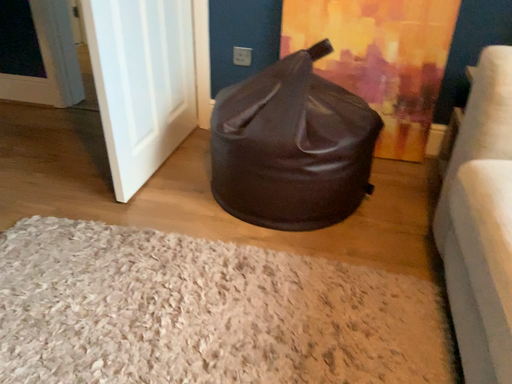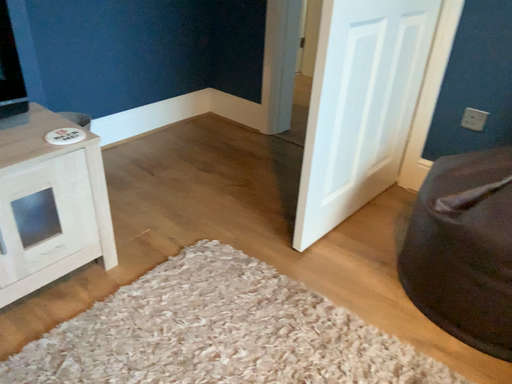
Question: How did the camera likely rotate when shooting the video?

Choices:
 (A) rotated left
 (B) rotated right

Answer: (A)